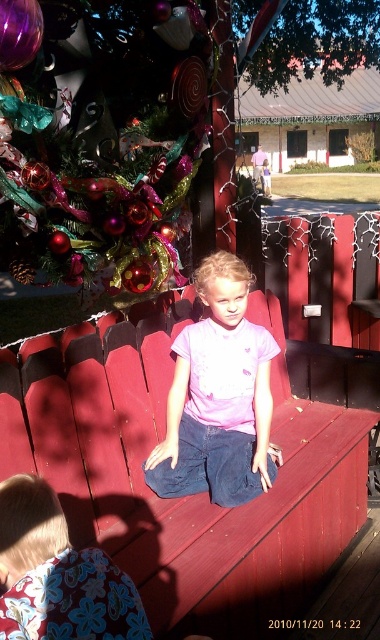
Question: Is matte wood park bench at center bigger than shiny metallic ornaments at upper left?

Choices:
 (A) no
 (B) yes

Answer: (B)

Question: Which of the following is the closest to the observer?

Choices:
 (A) (223, 483)
 (B) (41, 157)
 (C) (256, 540)
 (D) (1, 490)

Answer: (D)

Question: Observing the image, what is the correct spatial positioning of matte wood park bench at center in reference to shiny metallic ornaments at upper left?

Choices:
 (A) right
 (B) left

Answer: (A)

Question: Estimate the real-world distances between objects in this image. Which object is closer to the floral fabric at lower left?

Choices:
 (A) shiny metallic ornaments at upper left
 (B) matte wood park bench at center
 (C) pink matte shirt at center

Answer: (B)

Question: Is matte wood park bench at center in front of pink matte shirt at center?

Choices:
 (A) no
 (B) yes

Answer: (B)

Question: Which object appears farthest from the camera in this image?

Choices:
 (A) floral fabric at lower left
 (B) pink matte shirt at center
 (C) shiny metallic ornaments at upper left
 (D) matte wood park bench at center

Answer: (B)